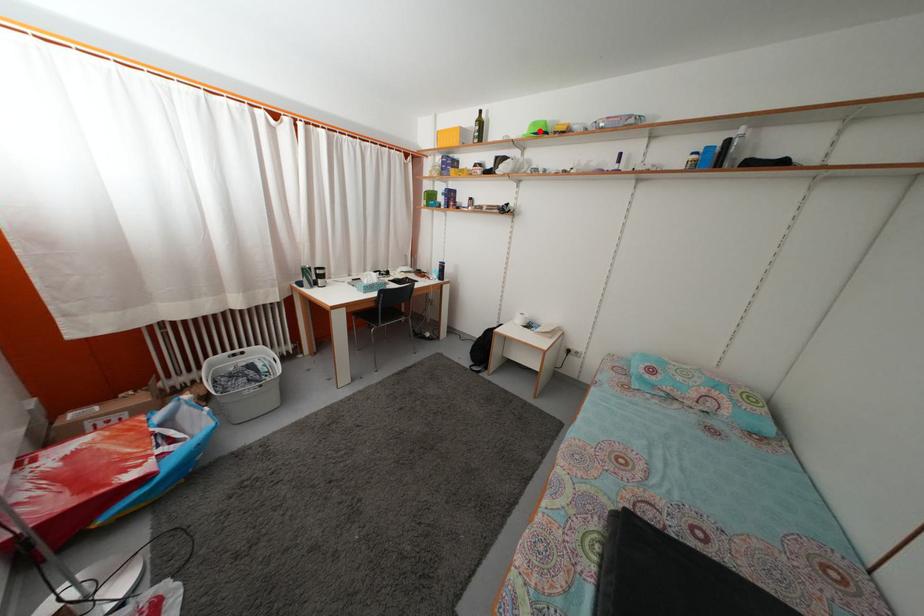
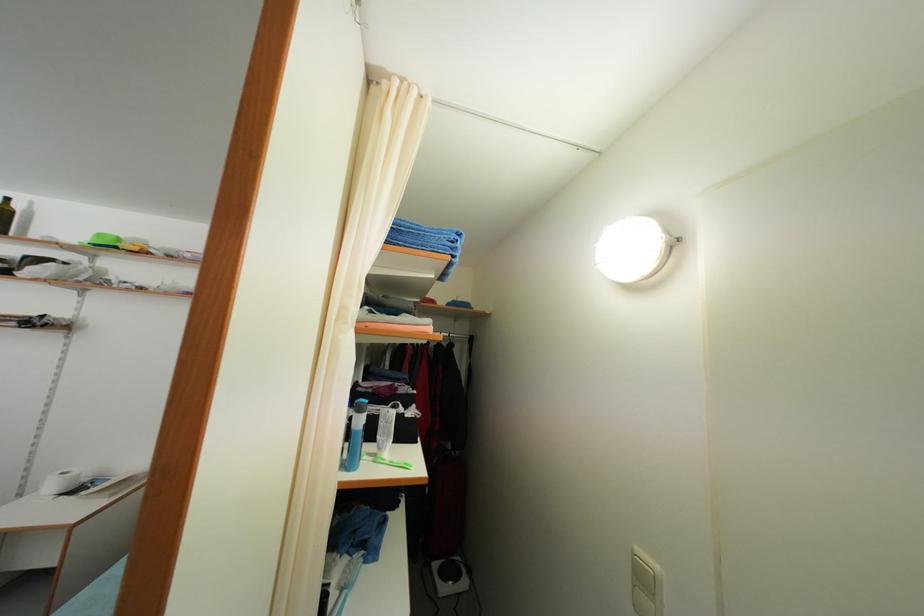
Where in the second image is the point corresponding to the highlighted location from the first image?

(104, 243)